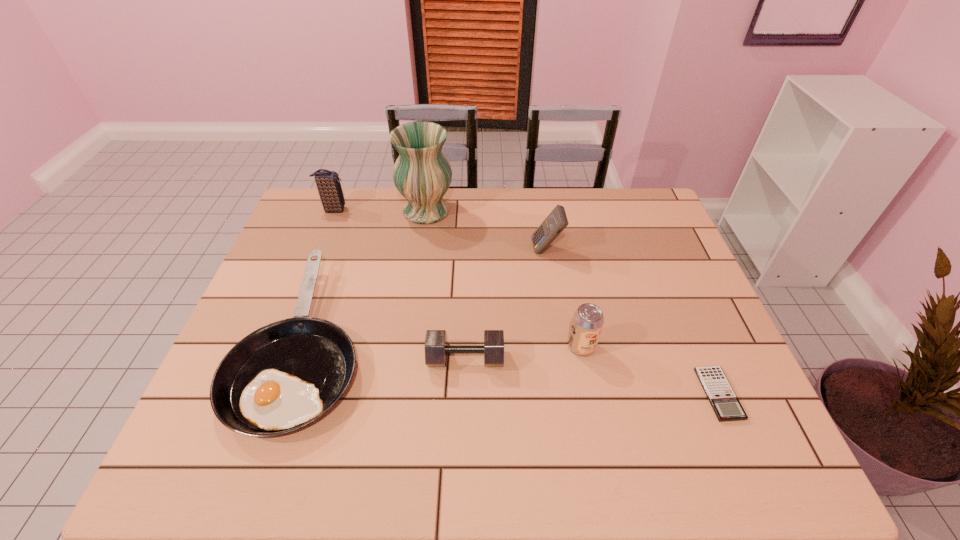
Find the location of a particular element. This screenshot has height=540, width=960. object situated at the near edge is located at coordinates (283, 376).

The width and height of the screenshot is (960, 540). Find the location of `clutch bag that is at the left edge`. clutch bag that is at the left edge is located at coordinates (329, 188).

The width and height of the screenshot is (960, 540). What are the coordinates of `frying pan present at the left edge` in the screenshot? It's located at (283, 376).

Where is `object that is at the right edge`? object that is at the right edge is located at coordinates (726, 405).

This screenshot has width=960, height=540. I want to click on object situated at the far left corner, so click(x=329, y=188).

This screenshot has width=960, height=540. In order to click on object that is at the near left corner in this screenshot , I will do `click(283, 376)`.

Identify the location of vacant space at the far edge of the desktop. Image resolution: width=960 pixels, height=540 pixels. (551, 205).

Find the location of `vacant space at the near edge`. vacant space at the near edge is located at coordinates (650, 442).

Find the location of a particular element. The width and height of the screenshot is (960, 540). free space at the left edge of the desktop is located at coordinates (276, 313).

Where is `vacant region at the right edge of the desktop`? Image resolution: width=960 pixels, height=540 pixels. vacant region at the right edge of the desktop is located at coordinates coord(665,260).